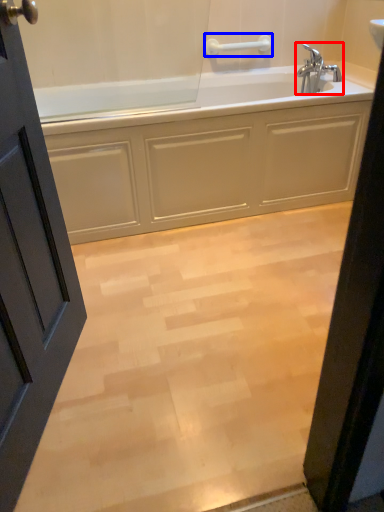
Question: Which of the following is the farthest to the observer, tap (highlighted by a red box) or towel bar (highlighted by a blue box)?

Choices:
 (A) tap
 (B) towel bar

Answer: (B)